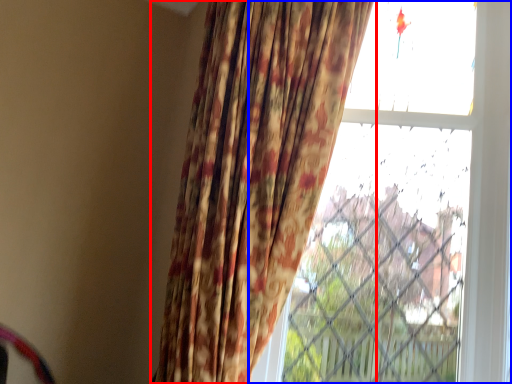
Question: Which of the following is the farthest to the observer, curtain (highlighted by a red box) or window (highlighted by a blue box)?

Choices:
 (A) curtain
 (B) window

Answer: (B)